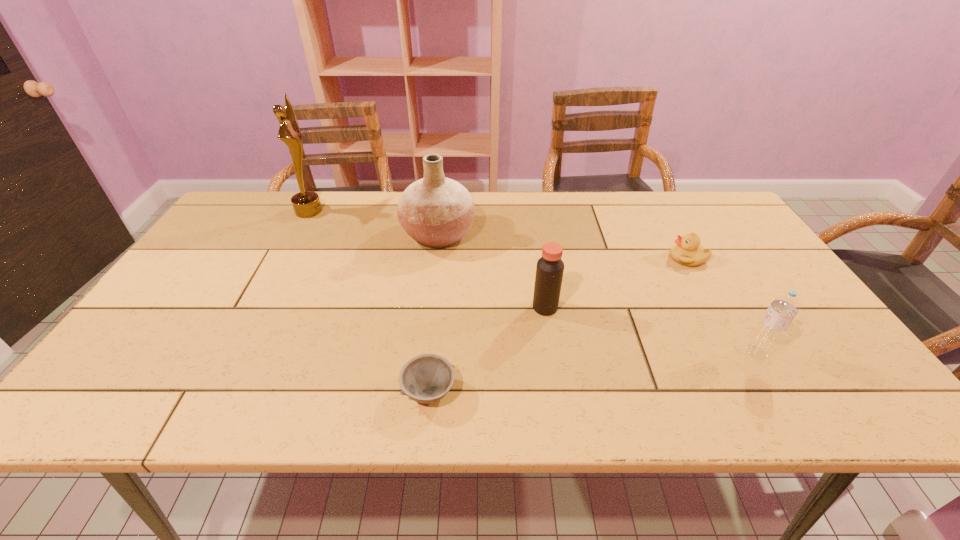
The height and width of the screenshot is (540, 960). What are the coordinates of `vacant space that satisfies the following two spatial constraints: 1. to pour from the handle of the pottery; 2. on the back side of the vinegar` in the screenshot? It's located at (429, 307).

The height and width of the screenshot is (540, 960). I want to click on vacant area that satisfies the following two spatial constraints: 1. to pour from the handle of the pottery; 2. on the left side of the water bottle, so click(423, 353).

The height and width of the screenshot is (540, 960). What are the coordinates of `blank area in the image that satisfies the following two spatial constraints: 1. to pour from the handle of the water bottle; 2. on the left side of the pottery` in the screenshot? It's located at (423, 353).

Identify the location of free space that satisfies the following two spatial constraints: 1. on the front-facing side of the leftmost object; 2. on the right side of the third object from right to left. (257, 307).

I want to click on free region that satisfies the following two spatial constraints: 1. on the back side of the water bottle; 2. on the front-facing side of the duckling, so pos(700,258).